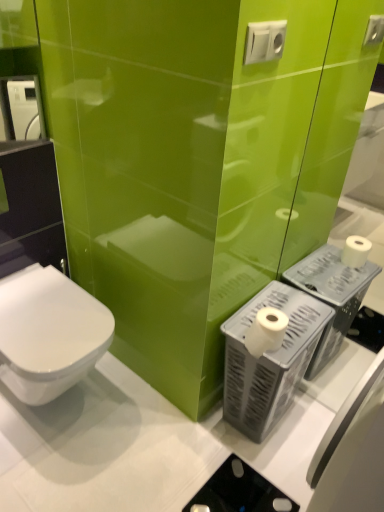
At what (x,y) coordinates should I click in order to perform the action: click on white plastic toilet paper holder at lower right. Please return your answer as a coordinate pair (x, y). Looking at the image, I should click on (269, 359).

What do you see at coordinates (264, 41) in the screenshot? I see `white plastic electric outlet at upper center` at bounding box center [264, 41].

Identify the location of white glossy toilet at lower left. (48, 333).

Considering the relative sizes of white matte toilet paper at right and white plastic toilet paper holder at lower right in the image provided, is white matte toilet paper at right wider than white plastic toilet paper holder at lower right?

In fact, white matte toilet paper at right might be narrower than white plastic toilet paper holder at lower right.

Considering the relative positions of white matte toilet paper at right and white plastic toilet paper holder at lower right in the image provided, is white matte toilet paper at right to the right of white plastic toilet paper holder at lower right from the viewer's perspective?

No, white matte toilet paper at right is not to the right of white plastic toilet paper holder at lower right.

Are white matte toilet paper at right and white plastic toilet paper holder at lower right far apart?

That's not correct — white matte toilet paper at right is a little close to white plastic toilet paper holder at lower right.

Choose the correct answer: Is white plastic electric outlet at upper center inside white plastic toilet paper holder at lower right or outside it?

white plastic electric outlet at upper center lies outside white plastic toilet paper holder at lower right.

Based on the photo, from the image's perspective, is white plastic electric outlet at upper center on white plastic toilet paper holder at lower right?

Correct, white plastic electric outlet at upper center appears higher than white plastic toilet paper holder at lower right in the image.

You are a GUI agent. You are given a task and a screenshot of the screen. Output one action in this format:
    pyautogui.click(x=<x>, y=<y>)
    Task: Click on the electric outlet above the white plastic toilet paper holder at lower right (from the image's perspective)
    
    Given the screenshot: What is the action you would take?
    pyautogui.click(x=264, y=41)

From the picture: Is white plastic electric outlet at upper center positioned far away from white plastic toilet paper holder at lower right?

white plastic electric outlet at upper center is actually quite close to white plastic toilet paper holder at lower right.

Considering the sizes of objects white plastic electric outlet at upper center and white glossy toilet at lower left in the image provided, who is shorter, white plastic electric outlet at upper center or white glossy toilet at lower left?

white plastic electric outlet at upper center.

What's the angular difference between white plastic electric outlet at upper center and white glossy toilet at lower left's facing directions?

The angle between the facing direction of white plastic electric outlet at upper center and the facing direction of white glossy toilet at lower left is 0.00553 degrees.

From the picture: From the image's perspective, is white plastic electric outlet at upper center positioned above or below white glossy toilet at lower left?

white plastic electric outlet at upper center is situated higher than white glossy toilet at lower left in the image.

Considering the positions of point (4, 362) and point (283, 346), is point (4, 362) closer or farther from the camera than point (283, 346)?

Point (4, 362).

Is white glossy toilet at lower left oriented towards white plastic toilet paper holder at lower right?

No, white glossy toilet at lower left is not turned towards white plastic toilet paper holder at lower right.

From a real-world perspective, does white glossy toilet at lower left stand above white plastic toilet paper holder at lower right?

Yes.

Image resolution: width=384 pixels, height=512 pixels. I want to click on appliance lying on the right of white glossy toilet at lower left, so click(x=269, y=359).

How different are the orientations of white matte toilet paper at right and white glossy toilet at lower left in degrees?

0.000927 degrees.

Can you confirm if white matte toilet paper at right is shorter than white glossy toilet at lower left?

Indeed, white matte toilet paper at right has a lesser height compared to white glossy toilet at lower left.

Is white matte toilet paper at right placed right next to white glossy toilet at lower left?

No, white matte toilet paper at right is not making contact with white glossy toilet at lower left.

Is white matte toilet paper at right at the right side of white glossy toilet at lower left?

Correct, you'll find white matte toilet paper at right to the right of white glossy toilet at lower left.

From the picture: Which of these two, white plastic toilet paper holder at lower right or white matte toilet paper at right, is smaller?

white matte toilet paper at right.

From the image's perspective, is white plastic toilet paper holder at lower right under white matte toilet paper at right?

Indeed, from the image's perspective, white plastic toilet paper holder at lower right is shown beneath white matte toilet paper at right.

Does white plastic toilet paper holder at lower right turn towards white matte toilet paper at right?

No, white plastic toilet paper holder at lower right is not turned towards white matte toilet paper at right.

Consider the image. How far apart are white plastic toilet paper holder at lower right and white matte toilet paper at right?

white plastic toilet paper holder at lower right is 18.64 centimeters away from white matte toilet paper at right.

In order to click on electric outlet above the white matte toilet paper at right (from the image's perspective) in this screenshot , I will do 264,41.

Is white plastic electric outlet at upper center in front of or behind white matte toilet paper at right in the image?

white plastic electric outlet at upper center is positioned closer to the viewer than white matte toilet paper at right.

Is white plastic electric outlet at upper center not near white matte toilet paper at right?

Actually, white plastic electric outlet at upper center and white matte toilet paper at right are a little close together.

From a real-world perspective, is white plastic electric outlet at upper center physically below white matte toilet paper at right?

Incorrect, from a real-world perspective, white plastic electric outlet at upper center is higher than white matte toilet paper at right.

Find the location of a particular element. Image resolution: width=384 pixels, height=512 pixels. appliance behind the white matte toilet paper at right is located at coordinates (269, 359).

Identify the location of electric outlet located in front of the white plastic toilet paper holder at lower right. (264, 41).

When comparing their distances from white matte toilet paper at right, does white plastic toilet paper holder at lower right or white glossy toilet at lower left seem further?

Among the two, white glossy toilet at lower left is located further to white matte toilet paper at right.

Considering their positions, is white plastic toilet paper holder at lower right positioned further to white plastic electric outlet at upper center than white glossy toilet at lower left?

Based on the image, white glossy toilet at lower left appears to be further to white plastic electric outlet at upper center.

Which object lies further to the anchor point white plastic toilet paper holder at lower right, white plastic electric outlet at upper center or white glossy toilet at lower left?

white plastic electric outlet at upper center lies further to white plastic toilet paper holder at lower right than the other object.

When comparing their distances from white matte toilet paper at right, does white glossy toilet at lower left or white plastic electric outlet at upper center seem closer?

The object closer to white matte toilet paper at right is white glossy toilet at lower left.

Based on their spatial positions, is white matte toilet paper at right or white glossy toilet at lower left closer to white plastic electric outlet at upper center?

white matte toilet paper at right is closer to white plastic electric outlet at upper center.

When comparing their distances from white plastic electric outlet at upper center, does white plastic toilet paper holder at lower right or white matte toilet paper at right seem closer?

white matte toilet paper at right is positioned closer to the anchor white plastic electric outlet at upper center.

Which object lies further to the anchor point white plastic toilet paper holder at lower right, white matte toilet paper at right or white plastic electric outlet at upper center?

Among the two, white plastic electric outlet at upper center is located further to white plastic toilet paper holder at lower right.

Considering their positions, is white plastic toilet paper holder at lower right positioned closer to white glossy toilet at lower left than white matte toilet paper at right?

Based on the image, white plastic toilet paper holder at lower right appears to be nearer to white glossy toilet at lower left.

The width and height of the screenshot is (384, 512). I want to click on toilet paper that lies between white plastic electric outlet at upper center and white plastic toilet paper holder at lower right from top to bottom, so click(x=266, y=331).

The height and width of the screenshot is (512, 384). In order to click on toilet paper that lies between white plastic electric outlet at upper center and white glossy toilet at lower left from top to bottom in this screenshot , I will do `click(266, 331)`.

The image size is (384, 512). In order to click on toilet between white plastic electric outlet at upper center and white plastic toilet paper holder at lower right vertically in this screenshot , I will do `click(48, 333)`.

Where is `toilet paper between white glossy toilet at lower left and white plastic toilet paper holder at lower right from left to right`? The width and height of the screenshot is (384, 512). toilet paper between white glossy toilet at lower left and white plastic toilet paper holder at lower right from left to right is located at coordinates point(266,331).